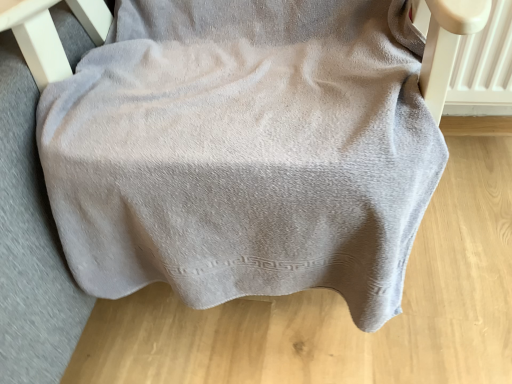
What do you see at coordinates (244, 152) in the screenshot? The image size is (512, 384). I see `gray cotton towel at center` at bounding box center [244, 152].

Locate an element on the screen. The height and width of the screenshot is (384, 512). gray cotton towel at center is located at coordinates (244, 152).

What is the approximate height of gray cotton towel at center?

26.29 inches.

Where is `gray cotton towel at center`? gray cotton towel at center is located at coordinates (244, 152).